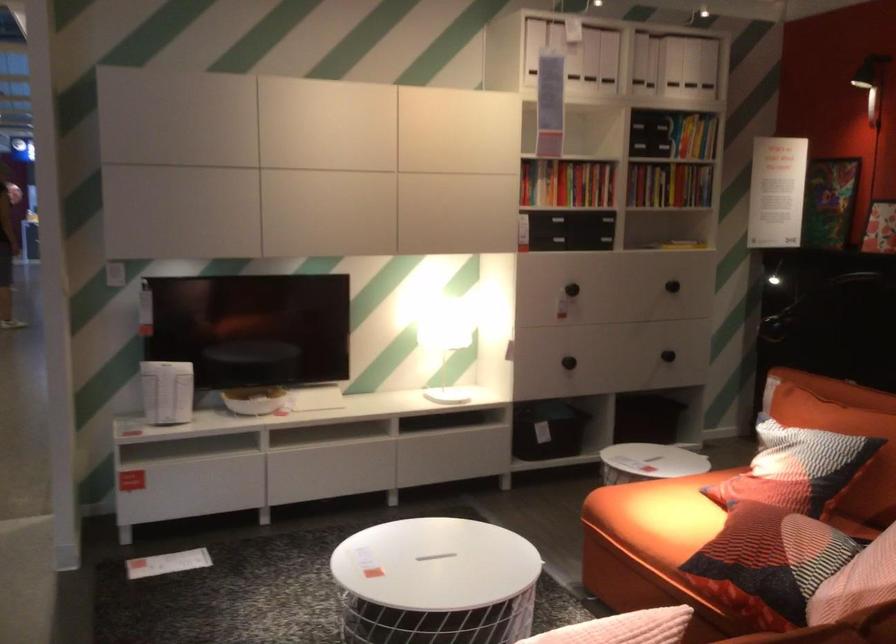
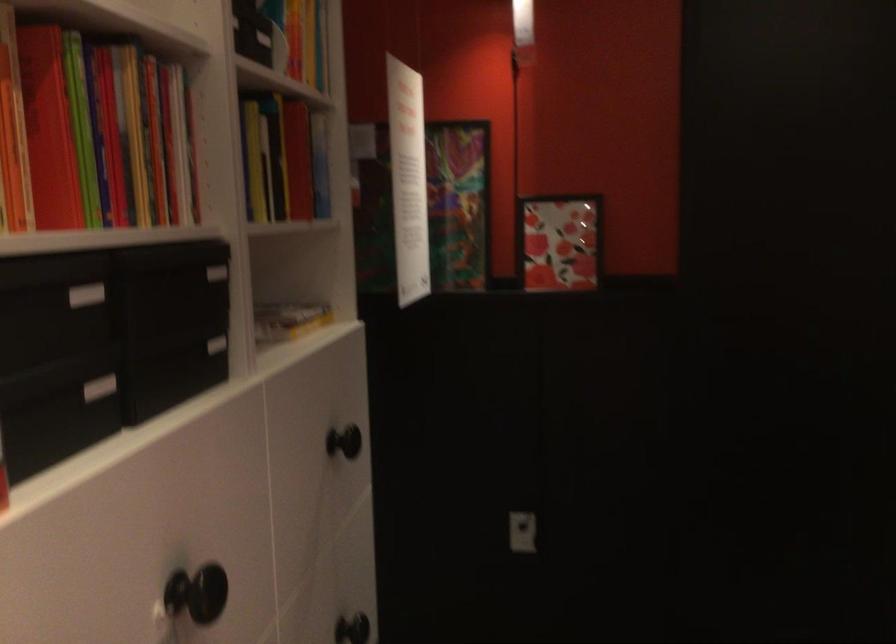
The point at (694, 210) is marked in the first image. Where is the corresponding point in the second image?

(288, 319)